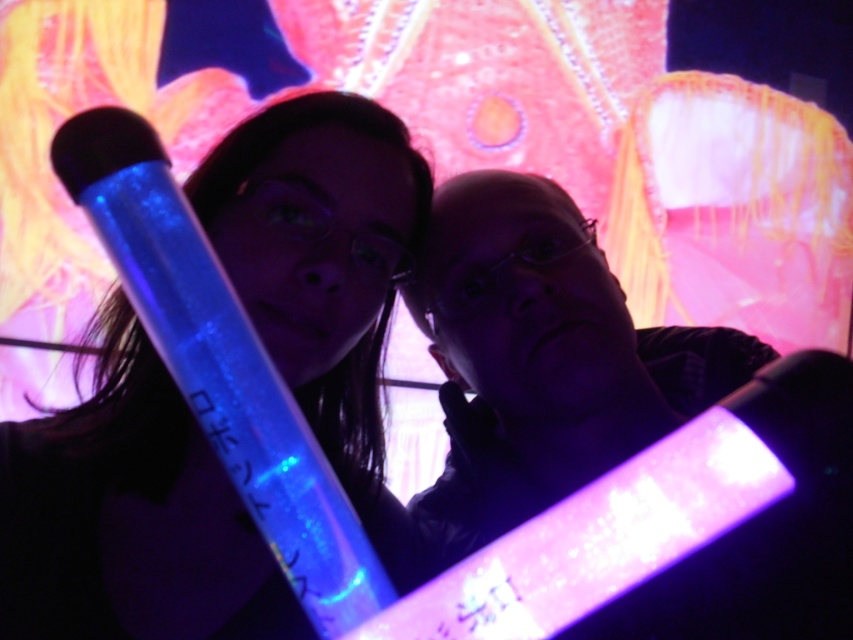
Does glowing plastic stick at center have a greater height compared to translucent plastic tube at center?

Correct, glowing plastic stick at center is much taller as translucent plastic tube at center.

Is glowing plastic stick at center thinner than translucent plastic tube at center?

Yes, glowing plastic stick at center is thinner than translucent plastic tube at center.

What do you see at coordinates (129, 515) in the screenshot?
I see `glowing plastic stick at center` at bounding box center [129, 515].

You are a GUI agent. You are given a task and a screenshot of the screen. Output one action in this format:
    pyautogui.click(x=<x>, y=<y>)
    Task: Click on the glowing plastic stick at center
    This screenshot has height=640, width=853.
    Given the screenshot: What is the action you would take?
    pyautogui.click(x=129, y=515)